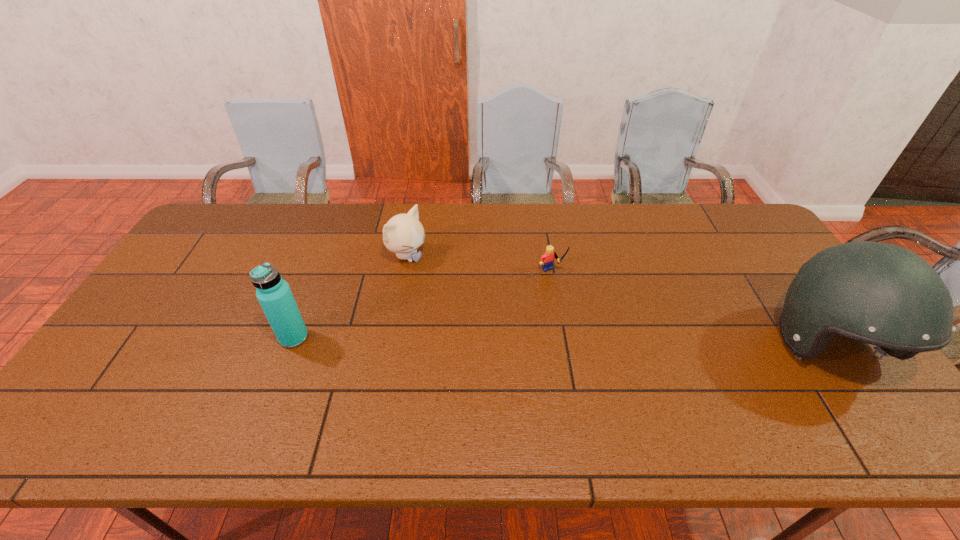
Find the location of a particular element. This screenshot has height=540, width=960. water bottle is located at coordinates (273, 293).

At what (x,y) coordinates should I click in order to perform the action: click on the third shortest object. Please return your answer as a coordinate pair (x, y). The image size is (960, 540). Looking at the image, I should click on (273, 293).

Locate an element on the screen. football helmet is located at coordinates (881, 294).

Locate an element on the screen. the tallest object is located at coordinates (881, 294).

The width and height of the screenshot is (960, 540). In order to click on the second object from right to left in this screenshot , I will do `click(547, 260)`.

Find the location of a particular element. the shortest object is located at coordinates (547, 260).

Identify the location of the third object from right to left. This screenshot has width=960, height=540. (403, 234).

Find the location of a particular element. kitten is located at coordinates (403, 234).

Where is `free spot located on the right of the water bottle`? The image size is (960, 540). free spot located on the right of the water bottle is located at coordinates (439, 338).

Locate an element on the screen. vacant space situated 0.250m on the front-facing side of the Lego is located at coordinates (606, 338).